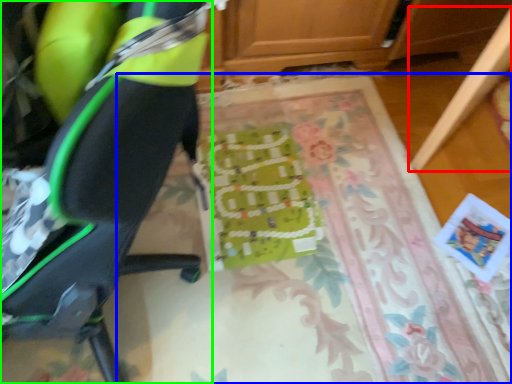
Question: Estimate the real-world distances between objects in this image. Which object is closer to furniture (highlighted by a red box), mat (highlighted by a blue box) or chair (highlighted by a green box)?

Choices:
 (A) mat
 (B) chair

Answer: (A)